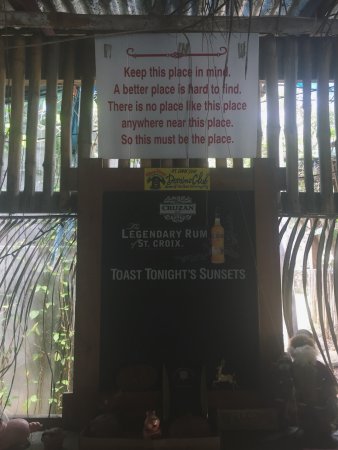
Find the location of `rum bottle`. rum bottle is located at coordinates (218, 244).